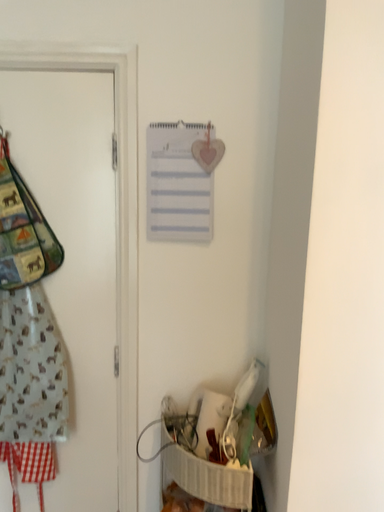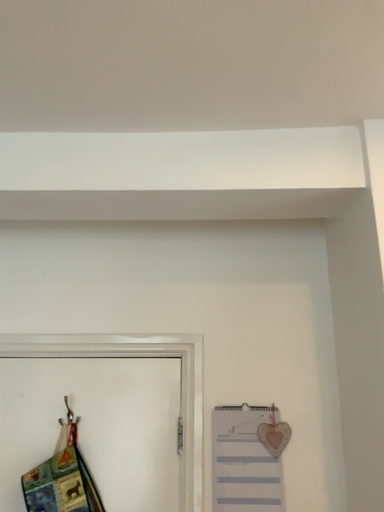
Question: How did the camera likely rotate when shooting the video?

Choices:
 (A) rotated downward
 (B) rotated upward

Answer: (B)